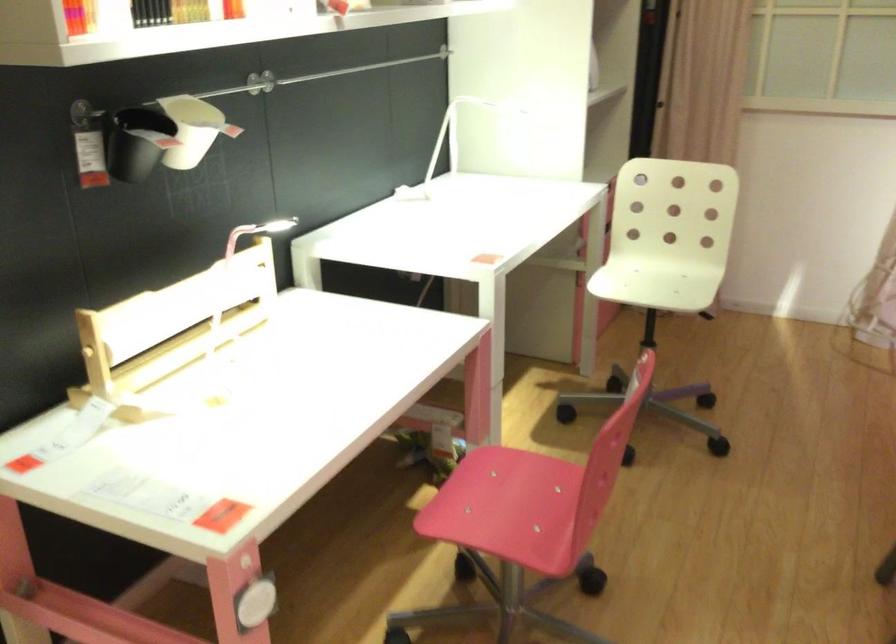
Consider the image. How did the camera likely rotate?

The rotation direction of the camera is left-down.